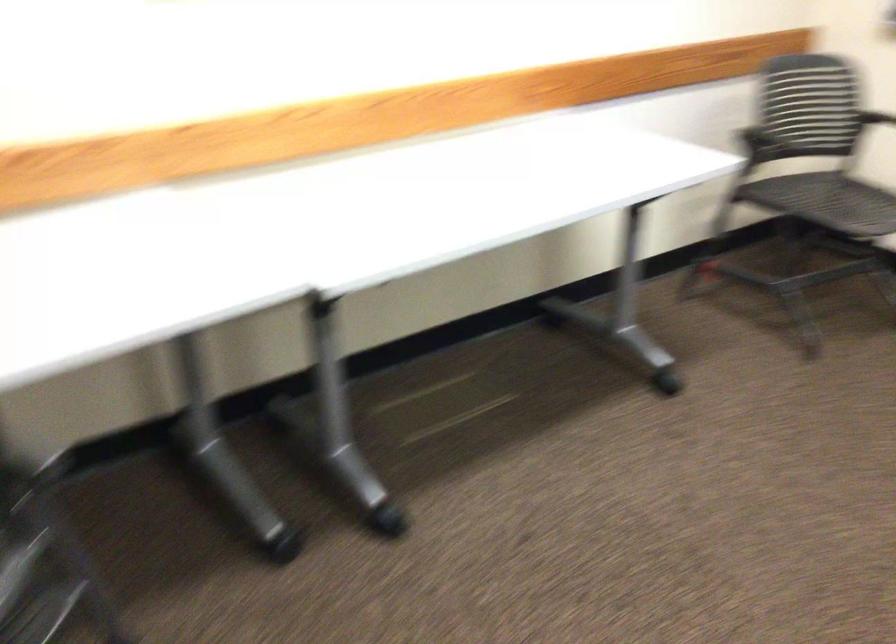
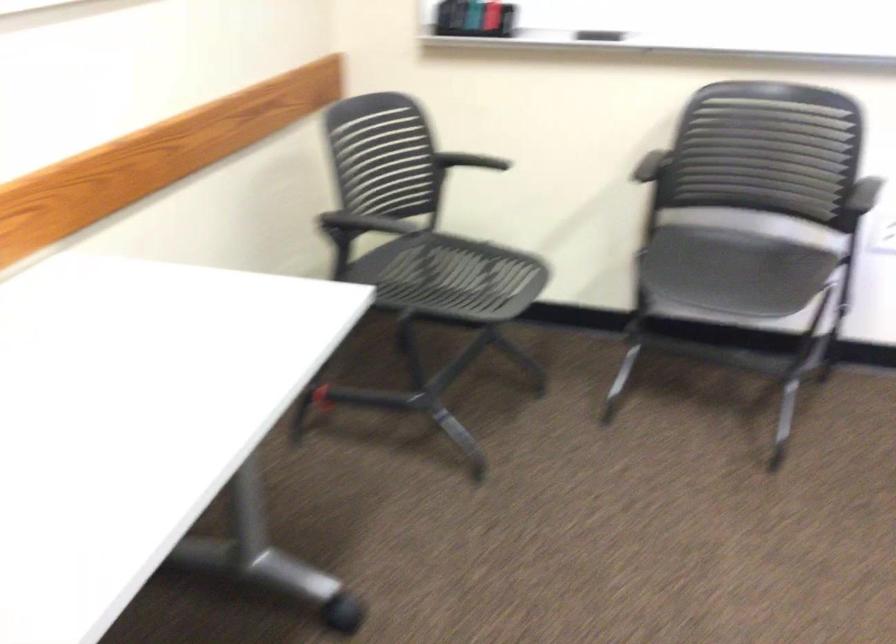
Find the pixel in the second image that matches point 771,131 in the first image.

(364, 223)